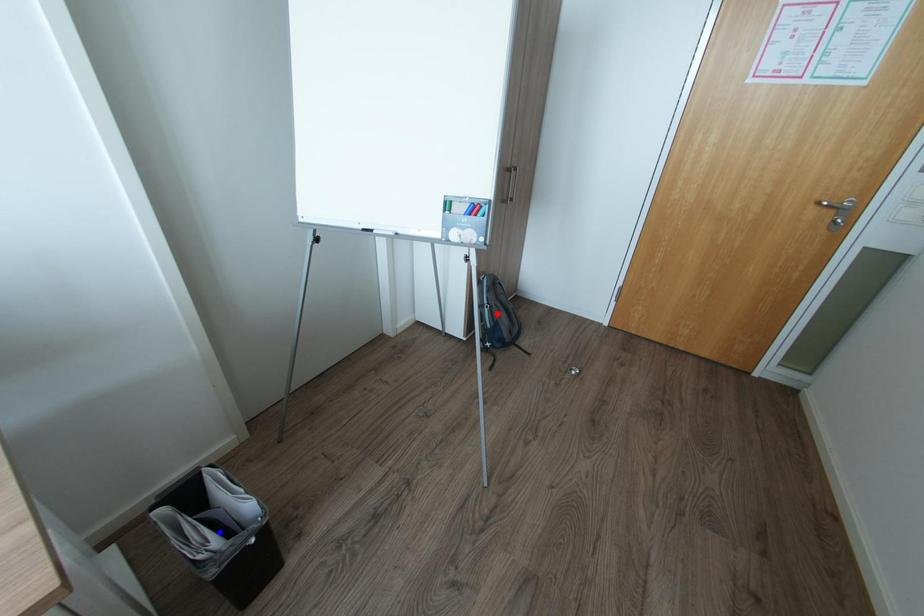
Question: In the image, two points are highlighted. Which point is nearer to the camera? Reply with the corresponding letter.

Choices:
 (A) blue point
 (B) red point

Answer: (A)